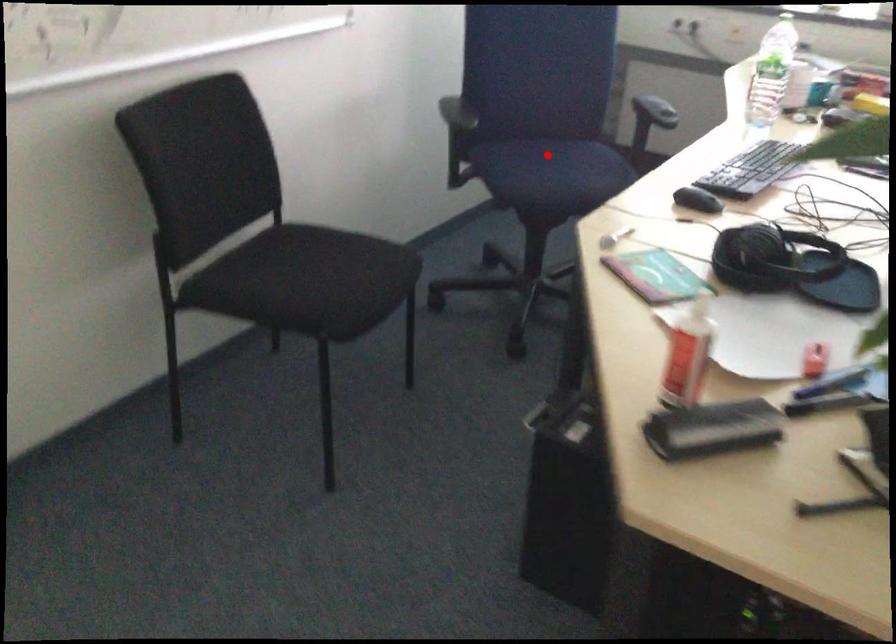
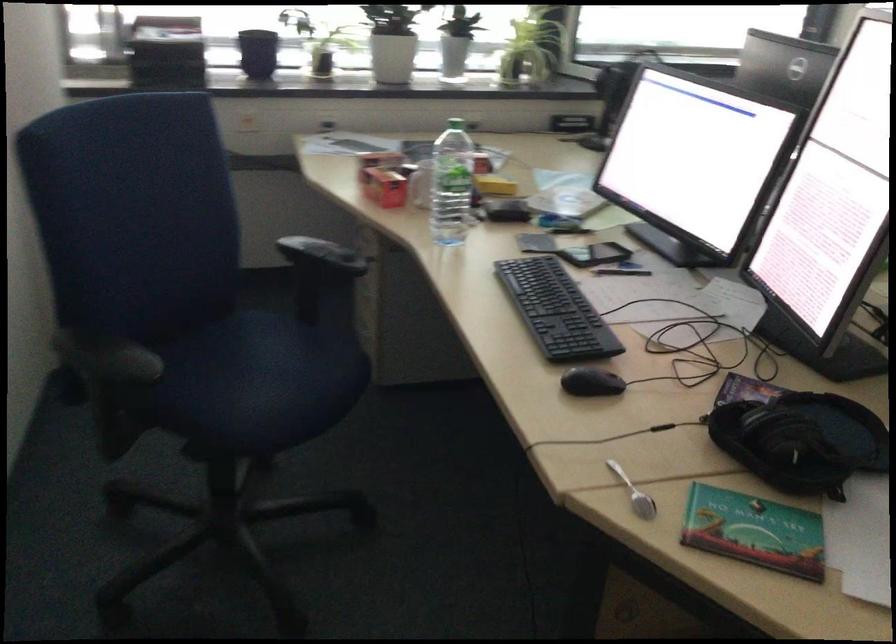
Where in the second image is the point corresponding to the highlighted location from the first image?

(245, 365)